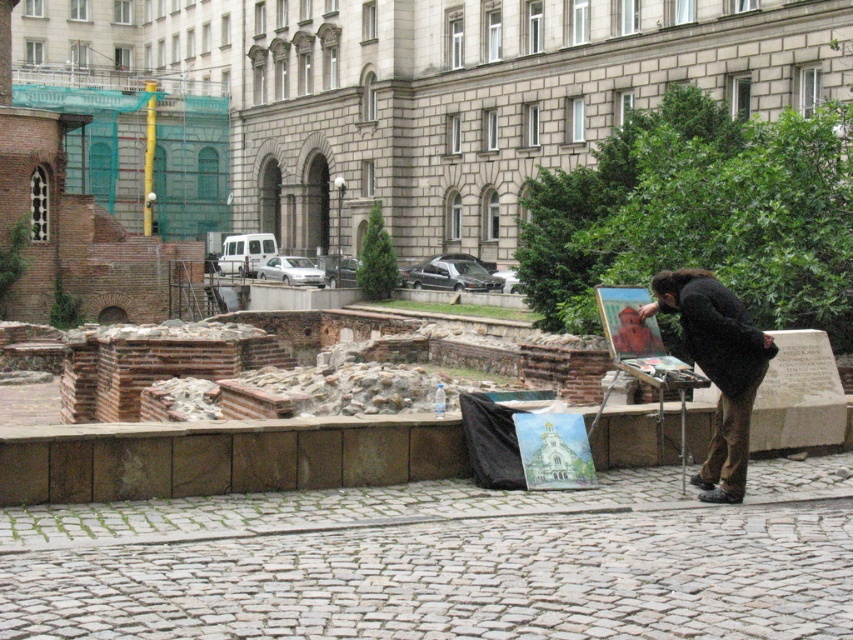
Question: Can you confirm if black fabric at right is positioned to the right of wooden easel at center?

Choices:
 (A) no
 (B) yes

Answer: (B)

Question: Is black fabric at right wider than wooden easel at center?

Choices:
 (A) no
 (B) yes

Answer: (B)

Question: Can you confirm if black fabric at right is positioned to the right of wooden easel at center?

Choices:
 (A) yes
 (B) no

Answer: (A)

Question: Which point is farther to the camera?

Choices:
 (A) (628, 332)
 (B) (663, 285)

Answer: (A)